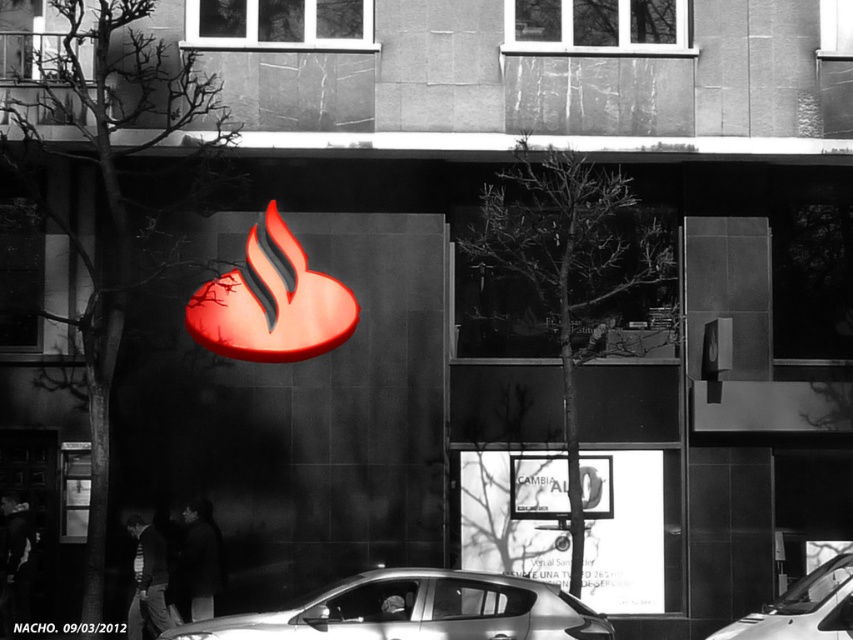
Is point (305, 292) in front of point (817, 596)?

No, it is behind (817, 596).

Which is in front, point (277, 333) or point (753, 621)?

Point (753, 621) is in front.

Where is `glossy plastic heart at center`? The image size is (853, 640). glossy plastic heart at center is located at coordinates (271, 301).

Which of these two, silver metallic car at lower center or glossy plastic heart at center, stands taller?

glossy plastic heart at center

Who is more forward, (485, 588) or (316, 326)?

Positioned in front is point (485, 588).

This screenshot has width=853, height=640. Identify the location of silver metallic car at lower center. (416, 611).

The image size is (853, 640). What do you see at coordinates (416, 611) in the screenshot? I see `silver metallic car at lower center` at bounding box center [416, 611].

Is silver metallic car at lower center positioned in front of white glossy car at lower right?

No, silver metallic car at lower center is behind white glossy car at lower right.

Does point (483, 579) come closer to viewer compared to point (728, 630)?

Yes, it is in front of point (728, 630).

Locate an element on the screen. silver metallic car at lower center is located at coordinates (416, 611).